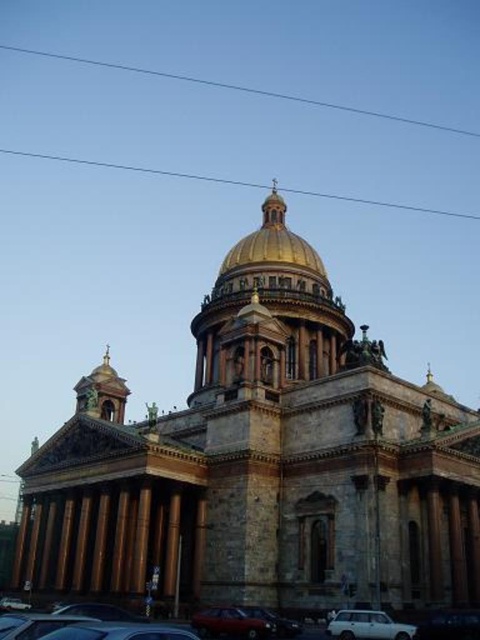
From the picture: You are standing in front of the grand cathedral with a golden dome. There is a point at coordinates point (352, 392) that you want to reach. If your maximum comfortable walking distance is 50 meters, can you comfortably walk to that point?

The distance of point (352, 392) from the viewer is 60.64 meters, which exceeds your maximum comfortable walking distance of 50 meters. Therefore, you cannot comfortably walk to that point.

You are an architect examining the cathedral design. You notice the clear blue wire at upper center and the metallic silver car at lower center in the image. Which object is positioned higher in the scene?

The clear blue wire at upper center is positioned higher than the metallic silver car at lower center.

You are a tour guide explaining the cathedral to visitors. You notice two cars parked near the cathedral entrance. The metallic silver car at lower center and the shiny red car at lower center. Which car is closer to the cathedral entrance?

The metallic silver car at lower center is closer to the cathedral entrance because it is in front of the shiny red car at lower center.